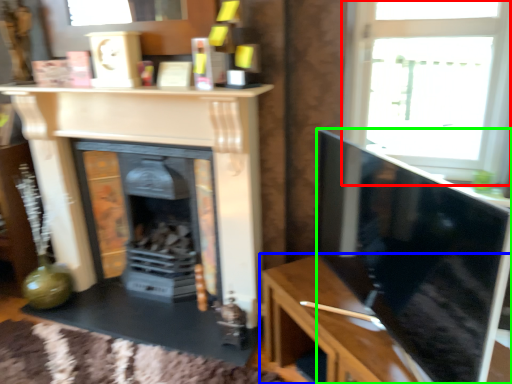
Question: Which object is positioned farthest from window (highlighted by a red box)? Select from table (highlighted by a blue box) and screen (highlighted by a green box).

Choices:
 (A) table
 (B) screen

Answer: (A)